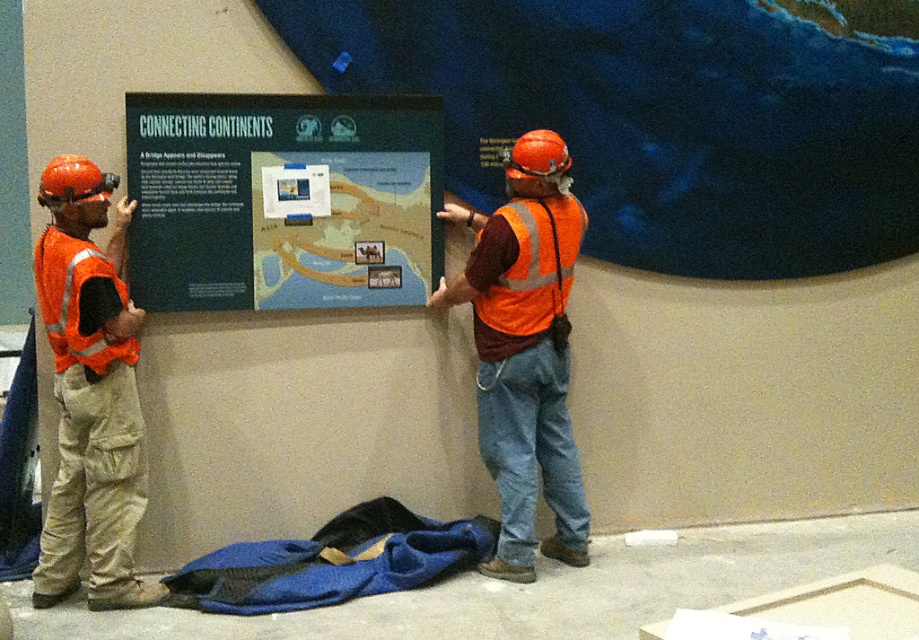
Between matte orange safety vest at left and orange reflective safety vest at center, which one is positioned lower?

matte orange safety vest at left is lower down.

Does matte orange safety vest at left have a lesser width compared to orange reflective safety vest at center?

No.

Which is in front, point (67, 541) or point (550, 272)?

Positioned in front is point (67, 541).

You are a GUI agent. You are given a task and a screenshot of the screen. Output one action in this format:
    pyautogui.click(x=<x>, y=<y>)
    Task: Click on the matte orange safety vest at left
    
    Given the screenshot: What is the action you would take?
    pyautogui.click(x=89, y=394)

Between green matte signboard at center and orange reflective safety vest at center, which one appears on the left side from the viewer's perspective?

green matte signboard at center

Who is more distant from viewer, (302, 241) or (540, 294)?

Positioned behind is point (302, 241).

Does point (348, 280) come in front of point (532, 234)?

No, it is not.

What are the coordinates of `green matte signboard at center` in the screenshot? It's located at (282, 200).

Can you confirm if reflective orange vest at center is bigger than matte orange safety vest at left?

Indeed, reflective orange vest at center has a larger size compared to matte orange safety vest at left.

Is point (554, 458) closer to viewer compared to point (135, 468)?

That is False.

At what (x,y) coordinates should I click in order to perform the action: click on reflective orange vest at center. Please return your answer as a coordinate pair (x, y). This screenshot has height=640, width=919. Looking at the image, I should click on (525, 352).